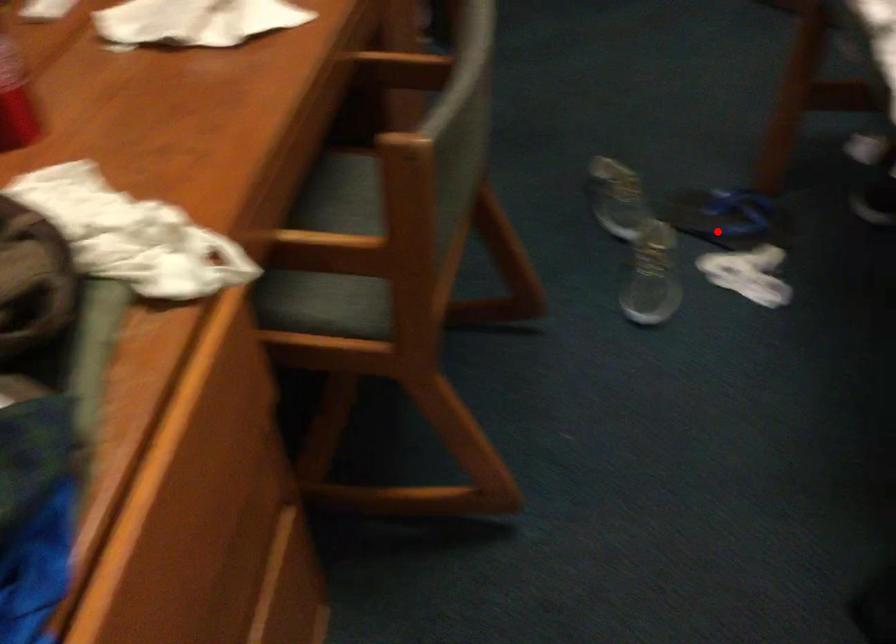
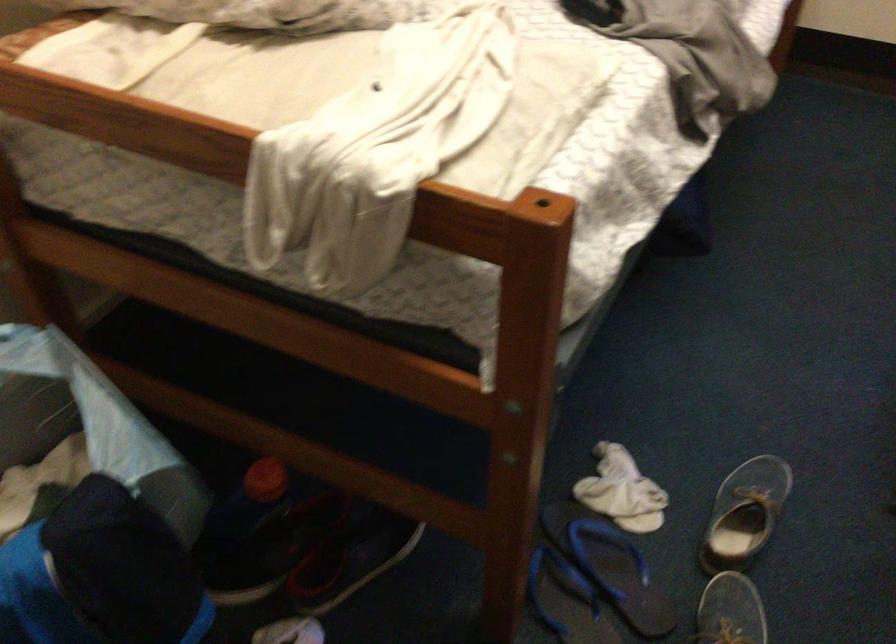
Question: A red point is marked in image1. In image2, is the corresponding 3D point closer to the camera or farther? Reply with the corresponding letter.

Choices:
 (A) The corresponding 3D point is closer.
 (B) The corresponding 3D point is farther.

Answer: (A)